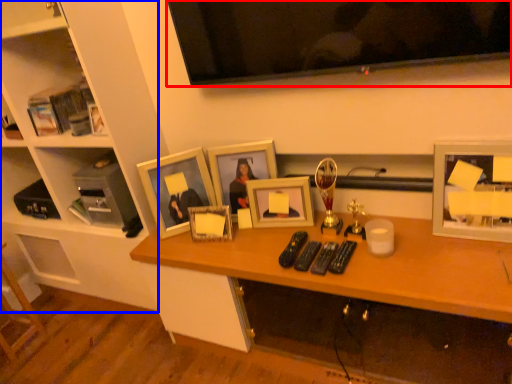
Question: Among these objects, which one is nearest to the camera, television (highlighted by a red box) or furniture (highlighted by a blue box)?

Choices:
 (A) television
 (B) furniture

Answer: (A)